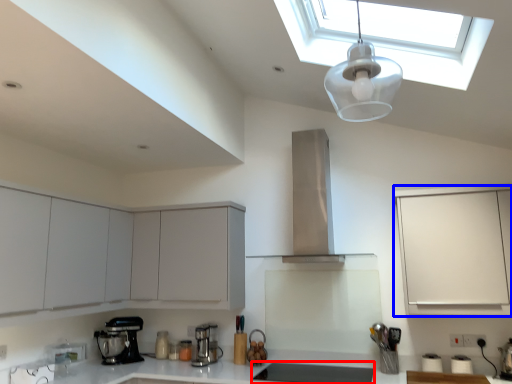
Question: Which of the following is the farthest to the observer, appliance (highlighted by a red box) or cabinetry (highlighted by a blue box)?

Choices:
 (A) appliance
 (B) cabinetry

Answer: (A)